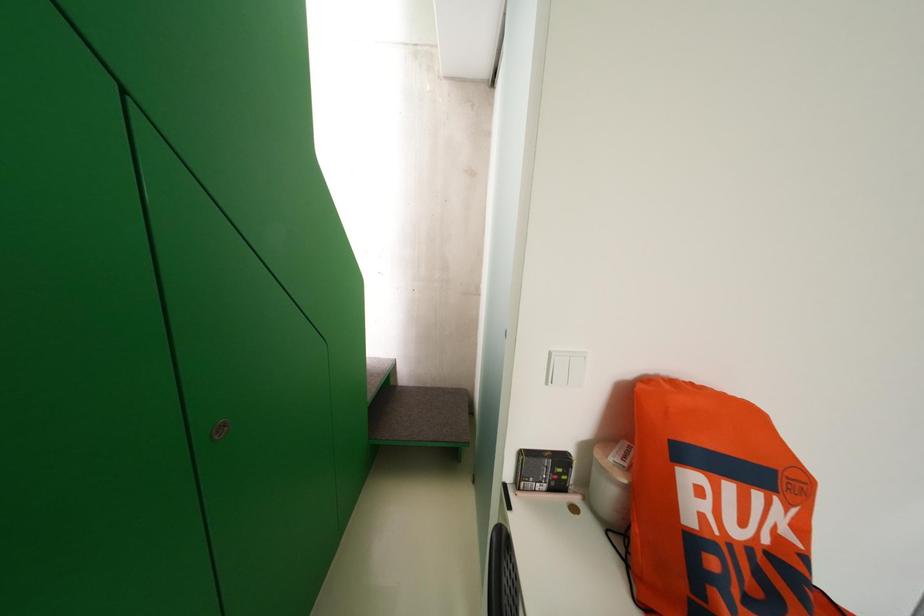
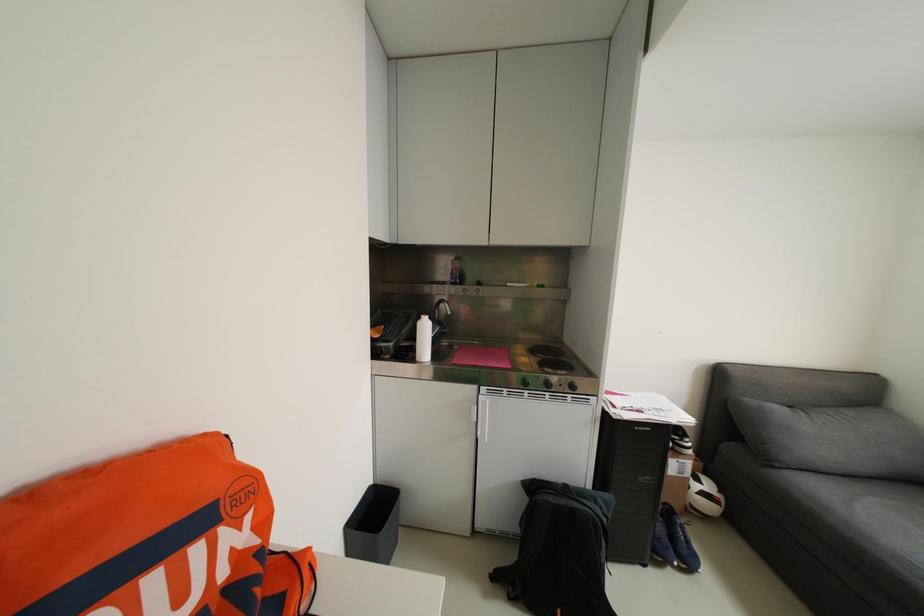
Question: How did the camera likely rotate?

Choices:
 (A) Left
 (B) Right
 (C) Up
 (D) Down

Answer: (B)